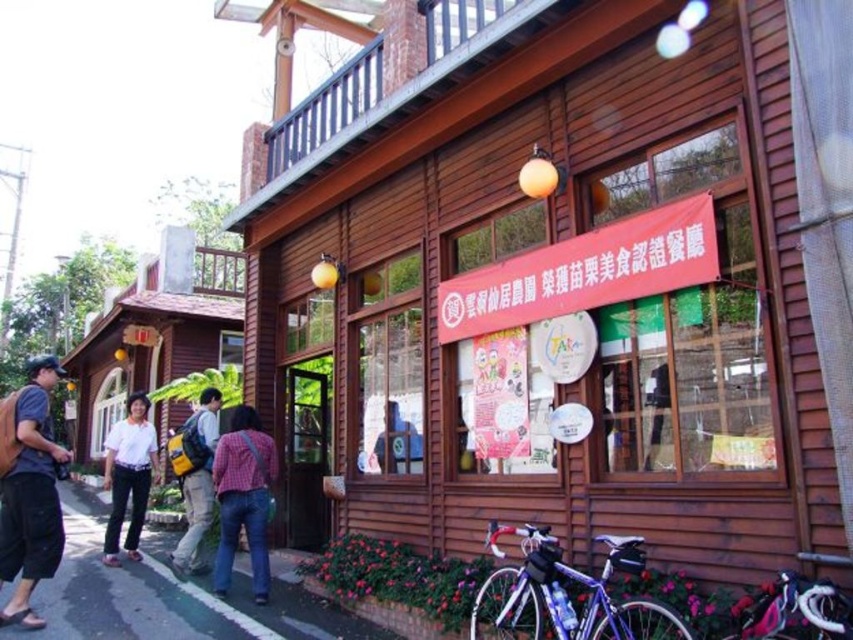
Is smooth asphalt sidewalk at lower left shorter than white shirt at center?

Incorrect, smooth asphalt sidewalk at lower left's height does not fall short of white shirt at center's.

Can you confirm if smooth asphalt sidewalk at lower left is wider than white shirt at center?

Correct, the width of smooth asphalt sidewalk at lower left exceeds that of white shirt at center.

Between point (102, 625) and point (129, 444), which one is positioned in front?

Point (102, 625)

Where is `smooth asphalt sidewalk at lower left`? This screenshot has width=853, height=640. smooth asphalt sidewalk at lower left is located at coordinates (166, 595).

Consider the image. Is wooden signboard at center further to the viewer compared to plaid shirt at center?

No, it is in front of plaid shirt at center.

Does wooden signboard at center appear under plaid shirt at center?

Actually, wooden signboard at center is above plaid shirt at center.

Does point (403, 364) come farther from viewer compared to point (219, 506)?

That is False.

You are a GUI agent. You are given a task and a screenshot of the screen. Output one action in this format:
    pyautogui.click(x=<x>, y=<y>)
    Task: Click on the wooden signboard at center
    
    Given the screenshot: What is the action you would take?
    pyautogui.click(x=567, y=276)

Is shiny purple bicycle at lower right to the right of white shirt at center from the viewer's perspective?

Indeed, shiny purple bicycle at lower right is positioned on the right side of white shirt at center.

Can you confirm if shiny purple bicycle at lower right is smaller than white shirt at center?

Actually, shiny purple bicycle at lower right might be larger than white shirt at center.

Locate an element on the screen. shiny purple bicycle at lower right is located at coordinates (566, 593).